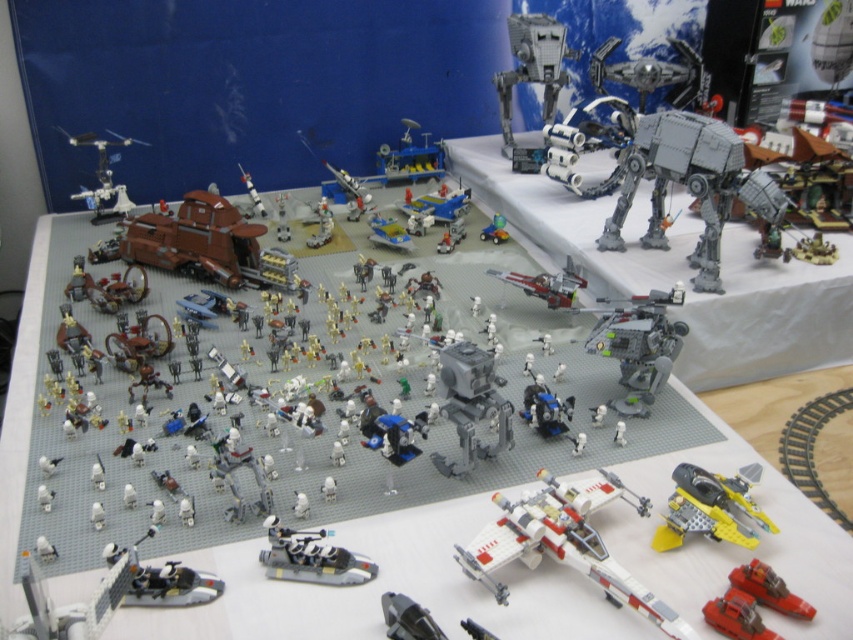
Is metallic silver robot at center shorter than shiny silver motorcycle at lower left?

Incorrect, metallic silver robot at center's height does not fall short of shiny silver motorcycle at lower left's.

Is point (666, 300) positioned before point (135, 579)?

That is False.

Does point (630, 348) come closer to viewer compared to point (186, 576)?

No, it is behind (186, 576).

What are the coordinates of `metallic silver robot at center` in the screenshot? It's located at (637, 344).

Is gray metallic walker at upper center bigger than shiny silver motorcycle at lower left?

Correct, gray metallic walker at upper center is larger in size than shiny silver motorcycle at lower left.

Can you confirm if gray metallic walker at upper center is taller than shiny silver motorcycle at lower left?

Correct, gray metallic walker at upper center is much taller as shiny silver motorcycle at lower left.

What are the coordinates of `gray metallic walker at upper center` in the screenshot? It's located at (532, 67).

You are a GUI agent. You are given a task and a screenshot of the screen. Output one action in this format:
    pyautogui.click(x=<x>, y=<y>)
    Task: Click on the gray metallic walker at upper center
    The height and width of the screenshot is (640, 853).
    Given the screenshot: What is the action you would take?
    pyautogui.click(x=532, y=67)

Which of these two, gray metallic walker at upper center or blue plastic airplane at center, stands taller?

With more height is gray metallic walker at upper center.

Is gray metallic walker at upper center taller than blue plastic airplane at center?

Yes.

The height and width of the screenshot is (640, 853). Identify the location of gray metallic walker at upper center. (532, 67).